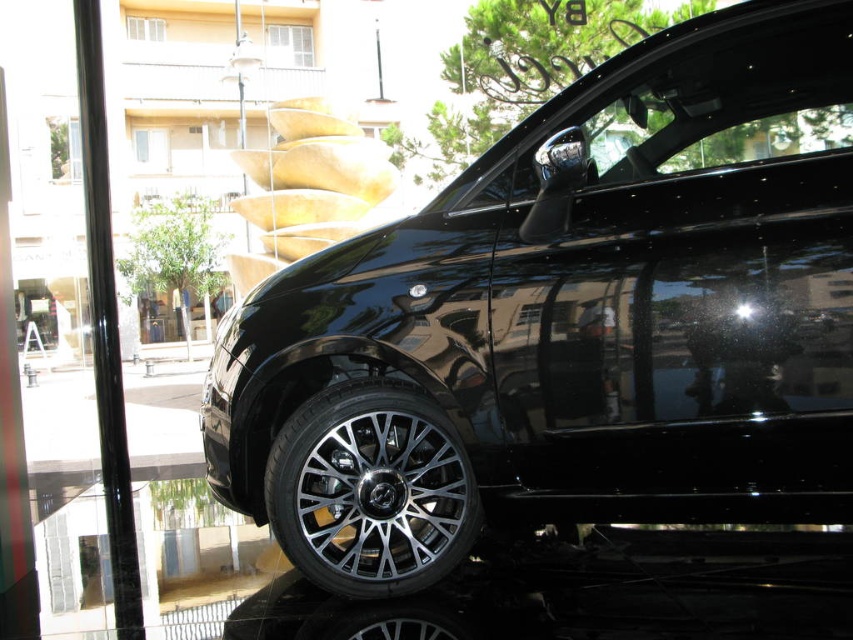
You are a delivery person trying to enter the showroom. You see the glossy black car at center and the transparent glass door at left. Which object is closer to you as you approach the entrance?

The glossy black car at center is closer to you than the transparent glass door at left because it is positioned in front of the transparent glass door at left.

You are standing in front of the sleek black car parked indoors. You notice a point at coordinates (370, 490). What object is located at that point?

The polished silver wheel at lower center is located at point (370, 490).

You are standing in the showroom looking at the black car. There are two points marked on the car. Which point is closer to you, point (x=285, y=436) or point (x=418, y=625)?

Point (x=285, y=436) is closer to you because it is further to the viewer than point (x=418, y=625).